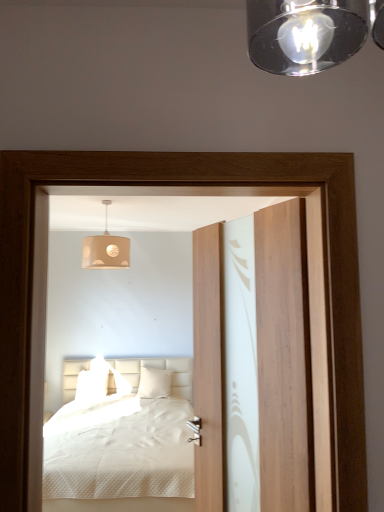
Question: Would you say white textured bed at center is to the left or to the right of transparent wood screen door at center in the picture?

Choices:
 (A) right
 (B) left

Answer: (B)

Question: In terms of height, does white textured bed at center look taller or shorter compared to transparent wood screen door at center?

Choices:
 (A) tall
 (B) short

Answer: (B)

Question: Based on their relative distances, which object is farther from the transparent wood screen door at center?

Choices:
 (A) white textured bed at center
 (B) wooden door at center
 (C) white soft pillow at center
 (D) beige fabric lampshade at upper center

Answer: (B)

Question: Estimate the real-world distances between objects in this image. Which object is closer to the white textured bed at center?

Choices:
 (A) beige fabric lampshade at upper center
 (B) transparent wood screen door at center
 (C) wooden door at center
 (D) white soft pillow at center

Answer: (D)